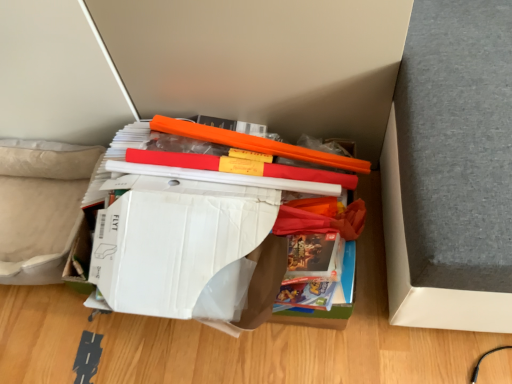
Question: In terms of height, does white cardboard box at center, positioned as the first paperback book in front-to-back order, look taller or shorter compared to white cardboard box at center, which is counted as the 1th paperback book, starting from the back?

Choices:
 (A) short
 (B) tall

Answer: (A)

Question: Considering the positions of white cardboard box at center, positioned as the first paperback book in front-to-back order, and white cardboard box at center, which ranks as the second paperback book in front-to-back order, in the image, is white cardboard box at center, positioned as the first paperback book in front-to-back order, bigger or smaller than white cardboard box at center, which ranks as the second paperback book in front-to-back order,?

Choices:
 (A) small
 (B) big

Answer: (A)

Question: Considering the real-world distances, which object is farthest from the orange plastic ruler at center?

Choices:
 (A) white cardboard box at center, which is counted as the 1th paperback book, starting from the back
 (B) white cardboard box at center, which ranks as the second paperback book in back-to-front order

Answer: (B)

Question: Which object is positioned farthest from the orange plastic ruler at center?

Choices:
 (A) white cardboard box at center, which is counted as the 1th paperback book, starting from the back
 (B) white cardboard box at center, which ranks as the second paperback book in back-to-front order

Answer: (B)